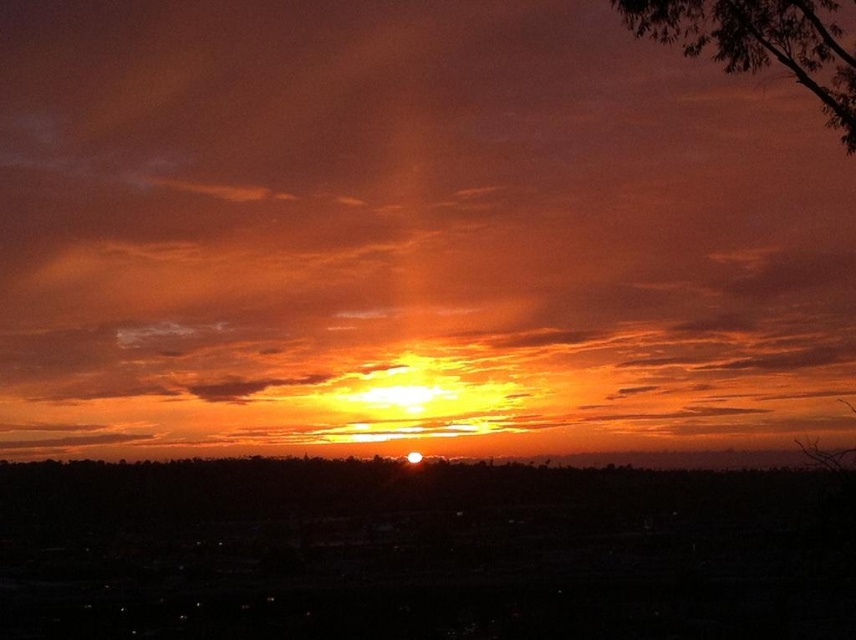
Question: Is orange matte cloud at center positioned in front of dark green leafy tree at upper right?

Choices:
 (A) yes
 (B) no

Answer: (B)

Question: Which object is closer to the camera taking this photo?

Choices:
 (A) dark green leafy tree at upper right
 (B) orange matte cloud at center

Answer: (A)

Question: In this image, where is orange matte cloud at center located relative to dark green leafy tree at upper right?

Choices:
 (A) right
 (B) left

Answer: (B)

Question: In this image, where is orange matte cloud at center located relative to dark green leafy tree at upper right?

Choices:
 (A) left
 (B) right

Answer: (A)